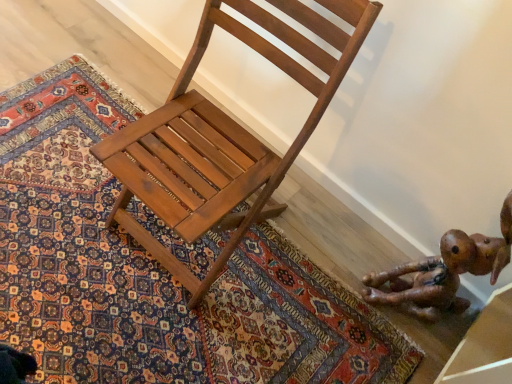
Question: Considering the relative sizes of brown leather toy at lower right and carpeted rug at center in the image provided, is brown leather toy at lower right smaller than carpeted rug at center?

Choices:
 (A) no
 (B) yes

Answer: (A)

Question: From the image's perspective, is brown leather toy at lower right under carpeted rug at center?

Choices:
 (A) no
 (B) yes

Answer: (B)

Question: Can you see brown leather toy at lower right touching carpeted rug at center?

Choices:
 (A) no
 (B) yes

Answer: (A)

Question: Is brown leather toy at lower right located outside carpeted rug at center?

Choices:
 (A) yes
 (B) no

Answer: (A)

Question: Can you confirm if brown leather toy at lower right is bigger than carpeted rug at center?

Choices:
 (A) yes
 (B) no

Answer: (A)

Question: Is carpeted rug at center spatially inside brown leather toy at lower right, or outside of it?

Choices:
 (A) inside
 (B) outside

Answer: (B)

Question: In the image, is carpeted rug at center positioned in front of or behind brown leather toy at lower right?

Choices:
 (A) behind
 (B) front

Answer: (A)

Question: Visually, is carpeted rug at center positioned to the left or to the right of brown leather toy at lower right?

Choices:
 (A) right
 (B) left

Answer: (B)

Question: Does point (325, 379) appear closer or farther from the camera than point (443, 261)?

Choices:
 (A) closer
 (B) farther

Answer: (B)

Question: Considering their positions, is brown leather toy at lower right located in front of or behind shiny brown wood chair at center?

Choices:
 (A) behind
 (B) front

Answer: (A)

Question: Is point (503, 256) positioned closer to the camera than point (372, 13)?

Choices:
 (A) closer
 (B) farther

Answer: (B)

Question: From a real-world perspective, is brown leather toy at lower right above or below shiny brown wood chair at center?

Choices:
 (A) below
 (B) above

Answer: (A)

Question: Would you say brown leather toy at lower right is inside or outside shiny brown wood chair at center?

Choices:
 (A) outside
 (B) inside

Answer: (A)

Question: Does point (197, 173) appear closer or farther from the camera than point (13, 107)?

Choices:
 (A) closer
 (B) farther

Answer: (A)

Question: Is shiny brown wood chair at center in front of or behind carpeted rug at center in the image?

Choices:
 (A) behind
 (B) front

Answer: (B)